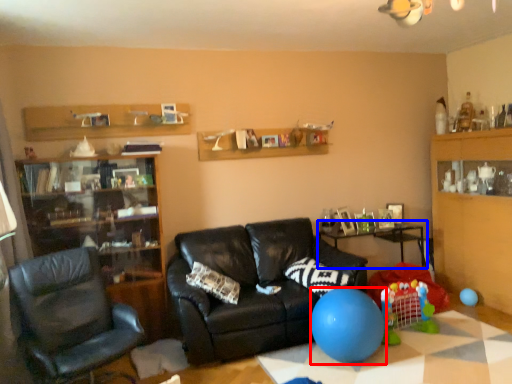
Question: Among these objects, which one is farthest to the camera, balloon (highlighted by a red box) or table (highlighted by a blue box)?

Choices:
 (A) balloon
 (B) table

Answer: (B)